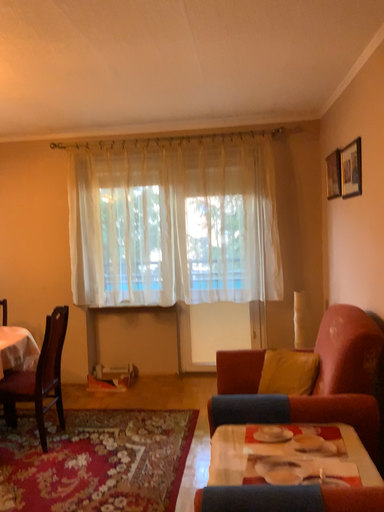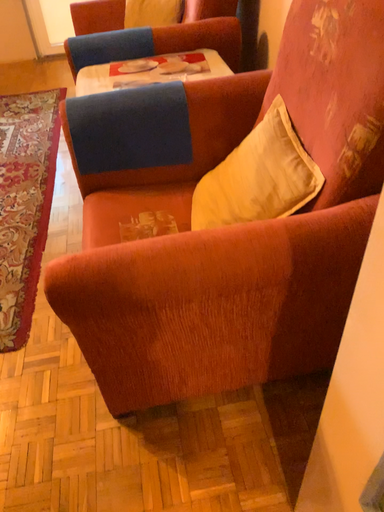
Question: How did the camera likely rotate when shooting the video?

Choices:
 (A) rotated left
 (B) rotated right

Answer: (B)